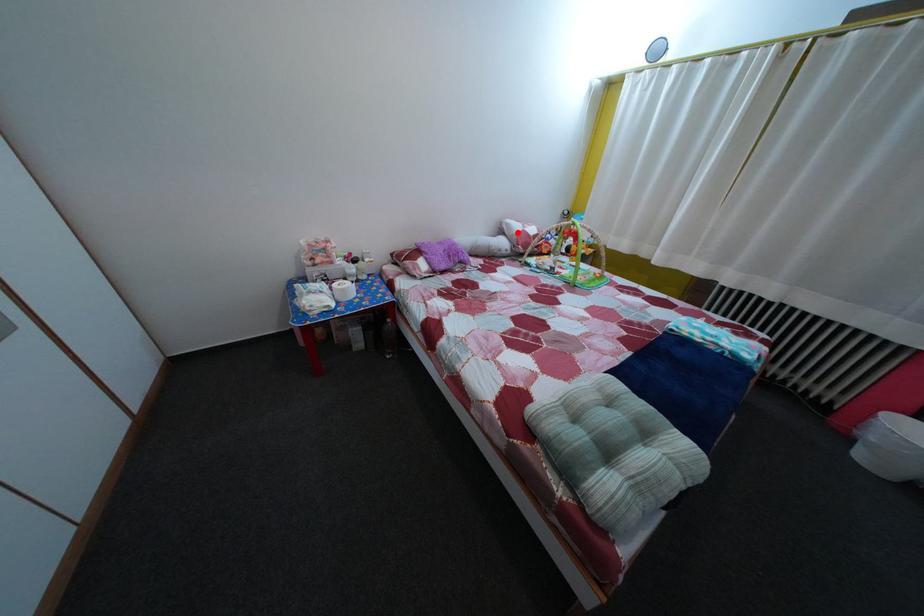
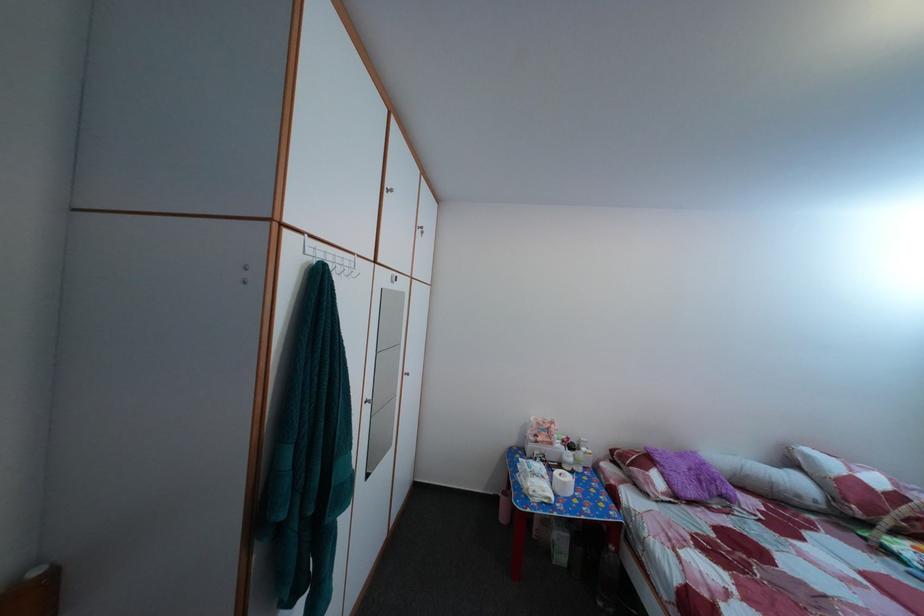
Question: I am providing you with two images of the same scene from different viewpoints. Image1 has a red point marked. In image2, the corresponding 3D location appears at what relative position? Reply with the corresponding letter.

Choices:
 (A) Closer
 (B) Farther

Answer: (B)